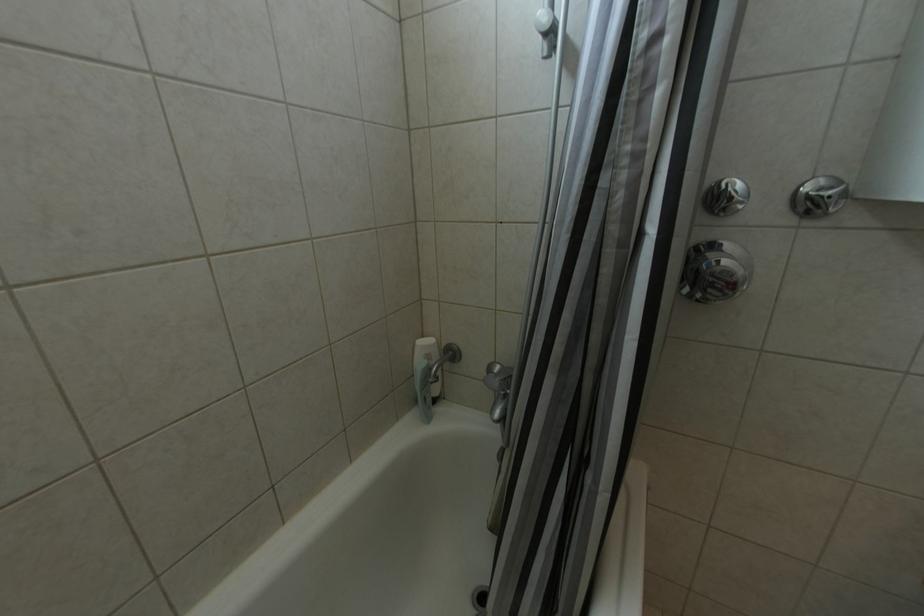
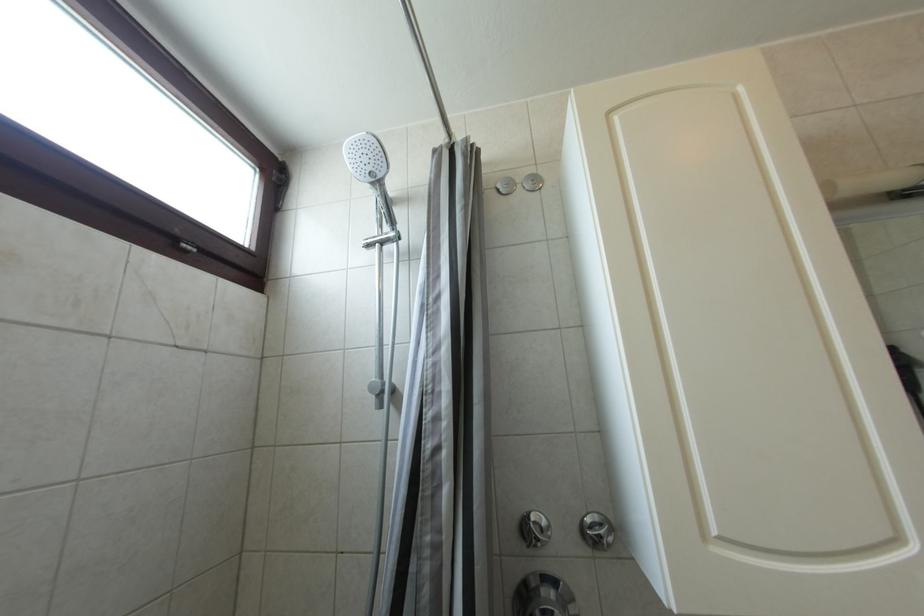
How did the camera likely rotate?

The camera's rotation is toward right-up.